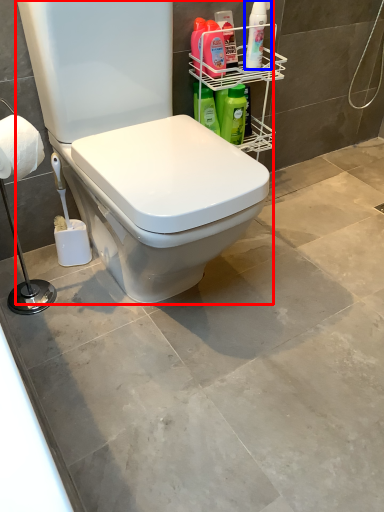
Question: Which point is further to the camera, toilet (highlighted by a red box) or cleaning product (highlighted by a blue box)?

Choices:
 (A) toilet
 (B) cleaning product

Answer: (B)